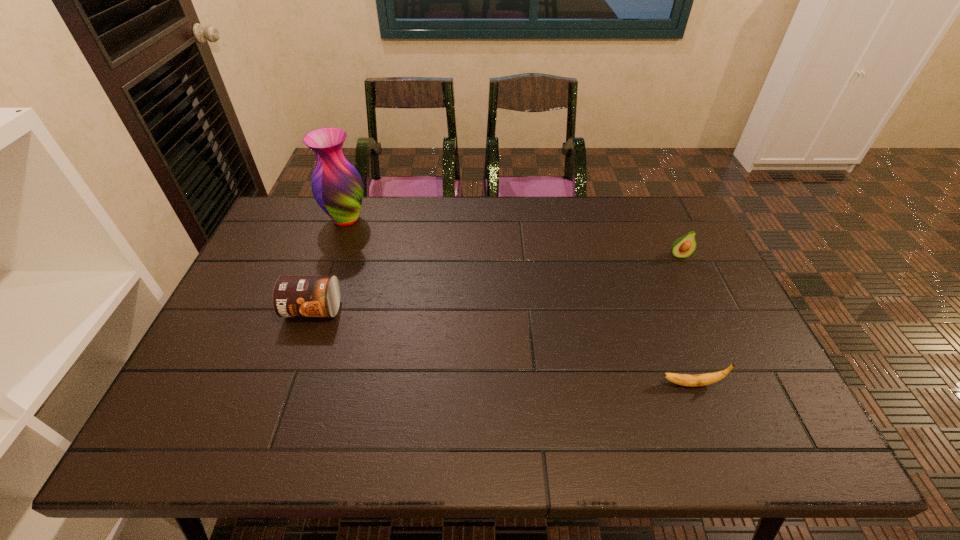
This screenshot has height=540, width=960. In the image, there is a desktop. Identify the location of vacant space at the far left corner. (283, 231).

In the image, there is a desktop. Where is `vacant space at the far right corner`? This screenshot has height=540, width=960. vacant space at the far right corner is located at coordinates (642, 201).

Locate an element on the screen. This screenshot has height=540, width=960. vacant area at the near right corner is located at coordinates (734, 420).

Where is `vacant space in between the tallest object and the can`? Image resolution: width=960 pixels, height=540 pixels. vacant space in between the tallest object and the can is located at coordinates (329, 265).

You are a GUI agent. You are given a task and a screenshot of the screen. Output one action in this format:
    pyautogui.click(x=<x>, y=<y>)
    Task: Click on the free space between the shortest object and the rightmost object
    The image size is (960, 540).
    Given the screenshot: What is the action you would take?
    pyautogui.click(x=684, y=320)

You are a GUI agent. You are given a task and a screenshot of the screen. Output one action in this format:
    pyautogui.click(x=<x>, y=<y>)
    Task: Click on the vacant space that is in between the farthest object and the can
    
    Given the screenshot: What is the action you would take?
    pyautogui.click(x=329, y=265)

I want to click on free spot between the shortest object and the tallest object, so click(x=518, y=301).

Locate an element on the screen. free point between the tallest object and the avocado is located at coordinates (513, 238).

Locate an element on the screen. Image resolution: width=960 pixels, height=540 pixels. vacant space that is in between the second farthest object and the vase is located at coordinates (513, 238).

At what (x,y) coordinates should I click in order to perform the action: click on free space that is in between the third nearest object and the second nearest object. Please return your answer as a coordinate pair (x, y). The width and height of the screenshot is (960, 540). Looking at the image, I should click on (496, 282).